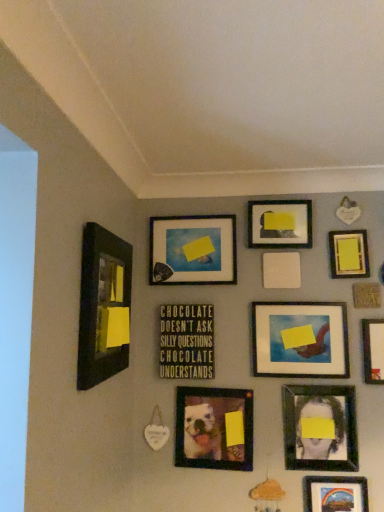
Question: From the image's perspective, is metallic rainbow landscape at bottom right, the tenth picture frame positioned from the back, beneath matte black portrait at lower right, placed as the 8th picture frame when sorted from back to front?

Choices:
 (A) no
 (B) yes

Answer: (B)

Question: Are metallic rainbow landscape at bottom right, the tenth picture frame positioned from the back, and matte black portrait at lower right, which is the fourth picture frame in front-to-back order, located far from each other?

Choices:
 (A) no
 (B) yes

Answer: (A)

Question: Can you confirm if metallic rainbow landscape at bottom right, the tenth picture frame positioned from the back, is smaller than matte black portrait at lower right, placed as the 8th picture frame when sorted from back to front?

Choices:
 (A) no
 (B) yes

Answer: (A)

Question: Is metallic rainbow landscape at bottom right, the tenth picture frame positioned from the back, wider than matte black portrait at lower right, which is the fourth picture frame in front-to-back order?

Choices:
 (A) yes
 (B) no

Answer: (A)

Question: Is the depth of metallic rainbow landscape at bottom right, arranged as the second picture frame when viewed from the front, less than that of matte black portrait at lower right, which is the fourth picture frame in front-to-back order?

Choices:
 (A) no
 (B) yes

Answer: (B)

Question: Can you confirm if metallic rainbow landscape at bottom right, arranged as the second picture frame when viewed from the front, is positioned to the right of matte black portrait at lower right, placed as the 8th picture frame when sorted from back to front?

Choices:
 (A) no
 (B) yes

Answer: (B)

Question: Considering the relative sizes of green matte signboard at center, which is the 4th picture frame from back to front, and matte black frame at upper center, arranged as the second picture frame when viewed from the back, in the image provided, is green matte signboard at center, which is the 4th picture frame from back to front, thinner than matte black frame at upper center, arranged as the second picture frame when viewed from the back,?

Choices:
 (A) yes
 (B) no

Answer: (A)

Question: Is green matte signboard at center, which is the 4th picture frame from back to front, at the left side of matte black frame at upper center, the tenth picture frame from the front?

Choices:
 (A) yes
 (B) no

Answer: (A)

Question: From the image's perspective, is green matte signboard at center, which is the 4th picture frame from back to front, on matte black frame at upper center, arranged as the second picture frame when viewed from the back?

Choices:
 (A) no
 (B) yes

Answer: (A)

Question: From a real-world perspective, is green matte signboard at center, which is the 4th picture frame from back to front, below matte black frame at upper center, arranged as the second picture frame when viewed from the back?

Choices:
 (A) no
 (B) yes

Answer: (B)

Question: Is green matte signboard at center, the 8th picture frame in the front-to-back sequence, aimed at matte black frame at upper center, arranged as the second picture frame when viewed from the back?

Choices:
 (A) no
 (B) yes

Answer: (A)

Question: Is green matte signboard at center, which is the 4th picture frame from back to front, positioned far away from matte black frame at upper center, the tenth picture frame from the front?

Choices:
 (A) no
 (B) yes

Answer: (A)

Question: Can you confirm if matte wood picture frame at center, the 9th picture frame when ordered from front to back, is positioned to the left of metallic rainbow landscape at bottom right, the tenth picture frame positioned from the back?

Choices:
 (A) yes
 (B) no

Answer: (A)